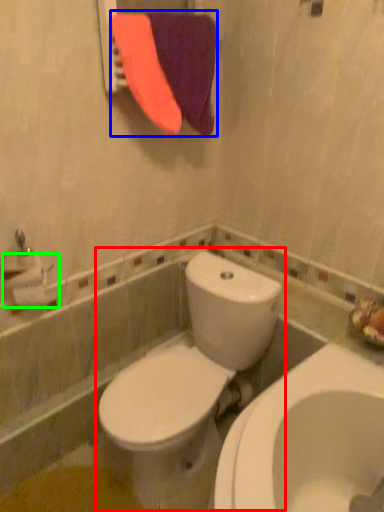
Question: Based on their relative distances, which object is farther from toilet (highlighted by a red box)? Choose from beach towel (highlighted by a blue box) and toilet paper (highlighted by a green box).

Choices:
 (A) beach towel
 (B) toilet paper

Answer: (A)